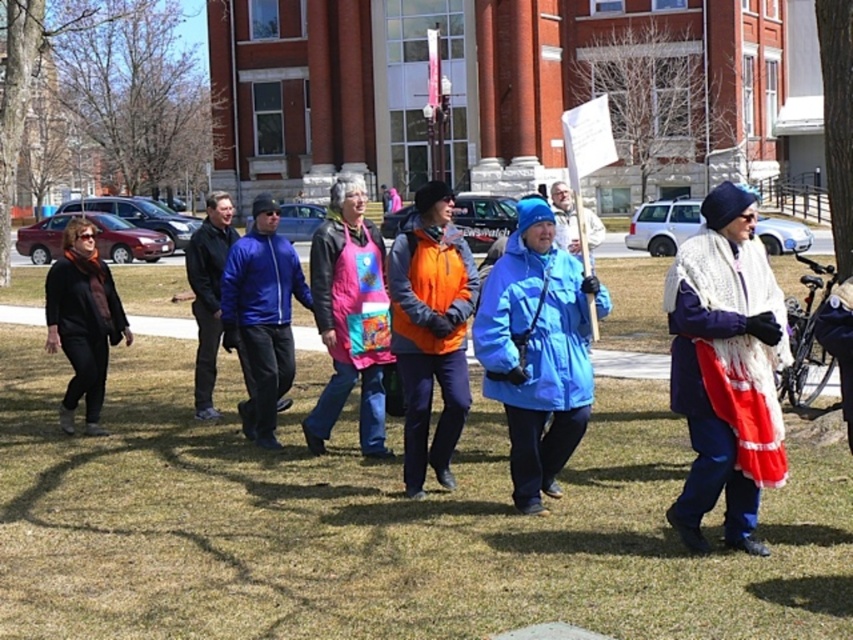
You are standing at the camera position and want to walk directly to the point marked as point (318,250). How far will you have to walk?

The point marked as point (318,250) is 7.49 meters away from the camera, so you will have to walk 7.49 meters to reach it.

You are a photographer trying to capture a photo of the green grass at center and the white knitted shawl at center. Which object should you focus on first if you want to ensure both are in the frame without moving the camera?

You should focus on the green grass at center first because it is wider than the white knitted shawl at center, ensuring it fits within the frame before adjusting for the smaller object.